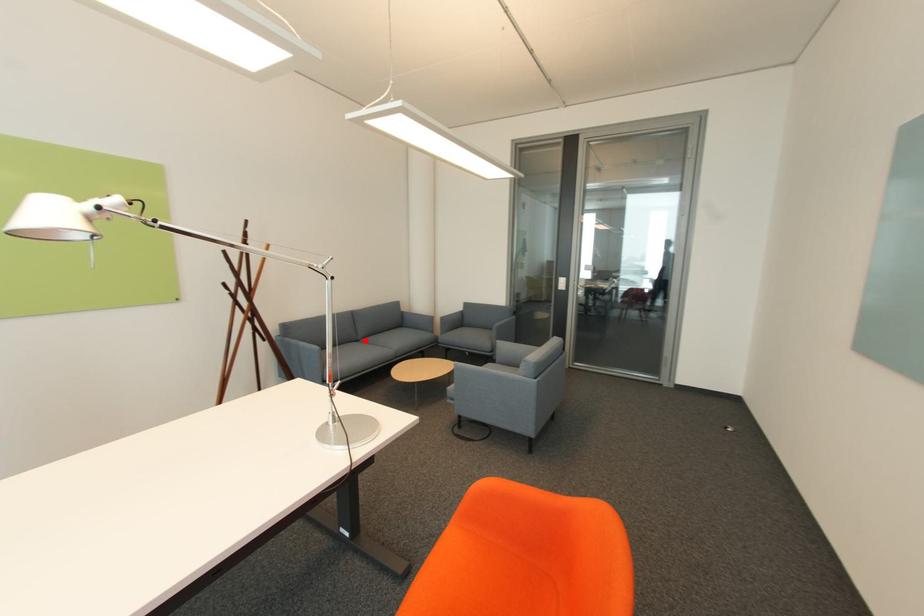
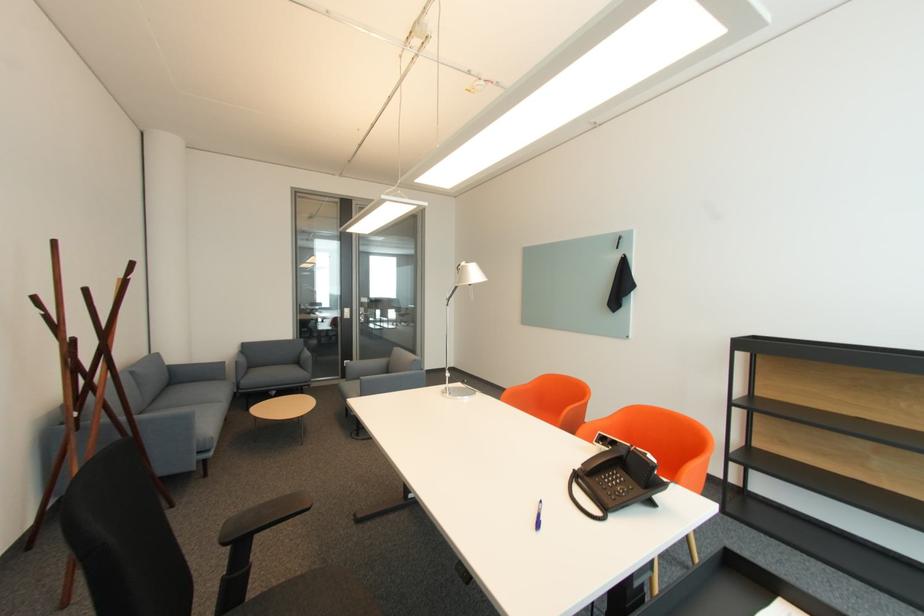
Locate, in the second image, the point that corresponds to the highlighted location in the first image.

(151, 411)